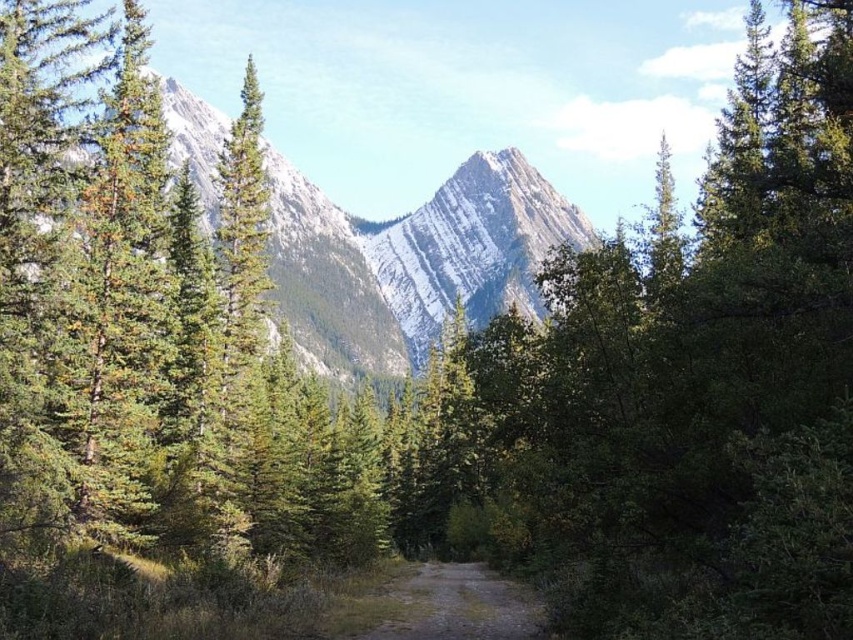
Does snowy granite peak at center have a larger size compared to brown dirt path at center?

Yes, snowy granite peak at center is bigger than brown dirt path at center.

Does snowy granite peak at center have a lesser width compared to brown dirt path at center?

No, snowy granite peak at center is not thinner than brown dirt path at center.

Where is `snowy granite peak at center`? The width and height of the screenshot is (853, 640). snowy granite peak at center is located at coordinates (469, 248).